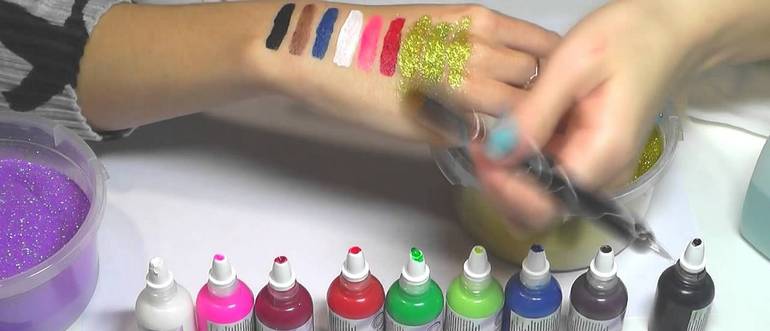
I want to click on table, so click(x=290, y=200).